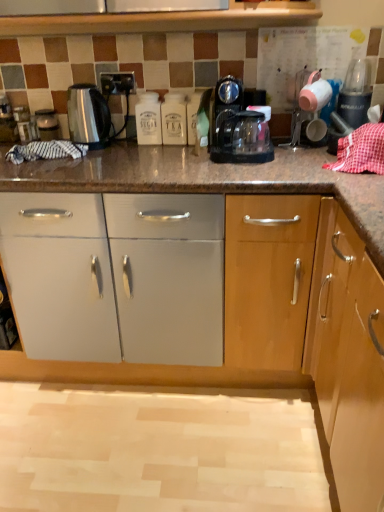
Question: From a real-world perspective, is white plastic tea container at center, the 2th bottle positioned from the left, on white matte sugar container at center, positioned as the 2th bottle in right-to-left order?

Choices:
 (A) no
 (B) yes

Answer: (A)

Question: Is white plastic tea container at center, which ranks as the first bottle in right-to-left order, smaller than white matte sugar container at center, positioned as the 2th bottle in right-to-left order?

Choices:
 (A) no
 (B) yes

Answer: (B)

Question: Considering the relative positions of white plastic tea container at center, which ranks as the first bottle in right-to-left order, and white matte sugar container at center, positioned as the 2th bottle in right-to-left order, in the image provided, is white plastic tea container at center, which ranks as the first bottle in right-to-left order, in front of white matte sugar container at center, positioned as the 2th bottle in right-to-left order,?

Choices:
 (A) yes
 (B) no

Answer: (A)

Question: Could you tell me if white plastic tea container at center, the 2th bottle positioned from the left, is facing white matte sugar container at center, positioned as the 1th bottle in left-to-right order?

Choices:
 (A) yes
 (B) no

Answer: (B)

Question: Is white plastic tea container at center, which ranks as the first bottle in right-to-left order, outside of white matte sugar container at center, positioned as the 2th bottle in right-to-left order?

Choices:
 (A) no
 (B) yes

Answer: (B)

Question: In the image, is transparent plastic coffee maker at center on the left side or the right side of satin silver kettle at left?

Choices:
 (A) right
 (B) left

Answer: (A)

Question: From a real-world perspective, is transparent plastic coffee maker at center above or below satin silver kettle at left?

Choices:
 (A) below
 (B) above

Answer: (B)

Question: In terms of height, does transparent plastic coffee maker at center look taller or shorter compared to satin silver kettle at left?

Choices:
 (A) tall
 (B) short

Answer: (A)

Question: Is point (230, 125) positioned closer to the camera than point (44, 122)?

Choices:
 (A) closer
 (B) farther

Answer: (A)

Question: Is white matte sugar container at center, positioned as the 1th bottle in left-to-right order, in front of or behind white plastic tea container at center, which ranks as the first bottle in right-to-left order, in the image?

Choices:
 (A) front
 (B) behind

Answer: (B)

Question: Based on their sizes in the image, would you say white matte sugar container at center, positioned as the 1th bottle in left-to-right order, is bigger or smaller than white plastic tea container at center, the 2th bottle positioned from the left?

Choices:
 (A) big
 (B) small

Answer: (A)

Question: Is white matte sugar container at center, positioned as the 2th bottle in right-to-left order, taller or shorter than white plastic tea container at center, the 2th bottle positioned from the left?

Choices:
 (A) short
 (B) tall

Answer: (B)

Question: Is white matte sugar container at center, positioned as the 2th bottle in right-to-left order, wider or thinner than white plastic tea container at center, which ranks as the first bottle in right-to-left order?

Choices:
 (A) thin
 (B) wide

Answer: (A)

Question: Is white matte sugar container at center, positioned as the 2th bottle in right-to-left order, situated inside satin silver kettle at left or outside?

Choices:
 (A) outside
 (B) inside

Answer: (A)

Question: Is point (155, 117) positioned closer to the camera than point (57, 135)?

Choices:
 (A) closer
 (B) farther

Answer: (A)